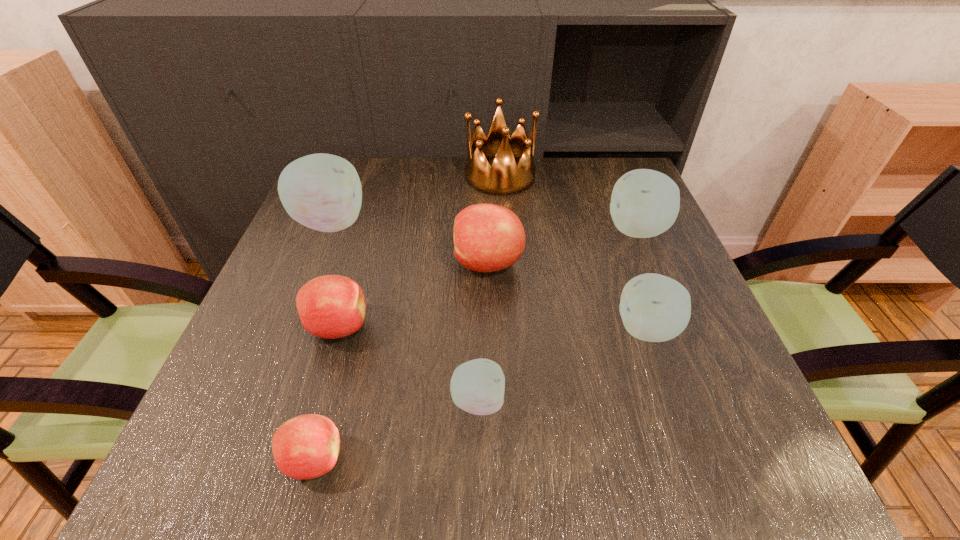
Find the location of `the farthest object`. the farthest object is located at coordinates (504, 177).

Locate an element on the screen. Image resolution: width=960 pixels, height=540 pixels. the biggest white apple is located at coordinates (323, 192).

Find the location of a particular element. This screenshot has height=540, width=960. the leftmost white apple is located at coordinates (323, 192).

Find the location of a particular element. Image resolution: width=960 pixels, height=540 pixels. the third smallest white apple is located at coordinates (644, 203).

Find the location of `the biggest red apple`. the biggest red apple is located at coordinates (487, 237).

Find the location of `the farthest red apple`. the farthest red apple is located at coordinates (487, 237).

The width and height of the screenshot is (960, 540). In order to click on the second smallest white apple in this screenshot , I will do `click(655, 308)`.

Locate an element on the screen. The height and width of the screenshot is (540, 960). the second smallest red apple is located at coordinates (331, 306).

Identify the location of the second nearest apple. (477, 386).

Locate an element on the screen. the smallest white apple is located at coordinates (477, 386).